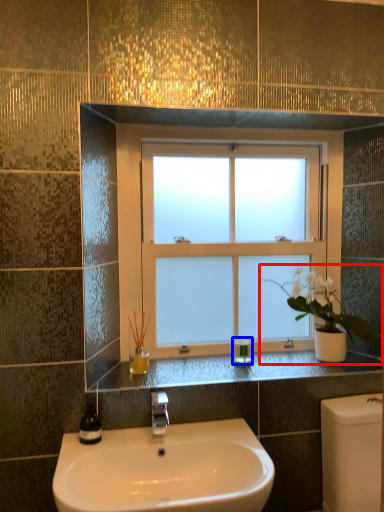
Question: Which point is closer to the camera, houseplant (highlighted by a red box) or toiletry (highlighted by a blue box)?

Choices:
 (A) houseplant
 (B) toiletry

Answer: (A)